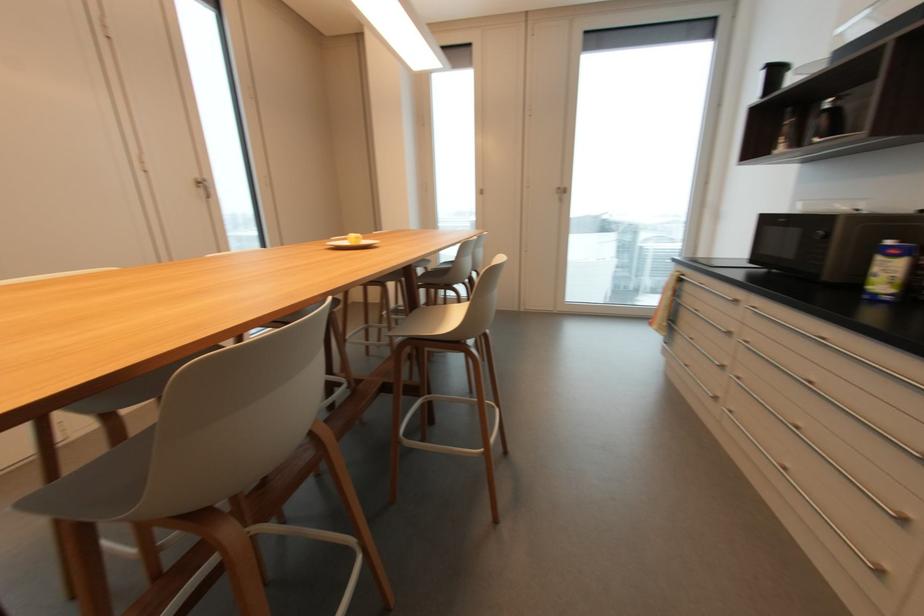
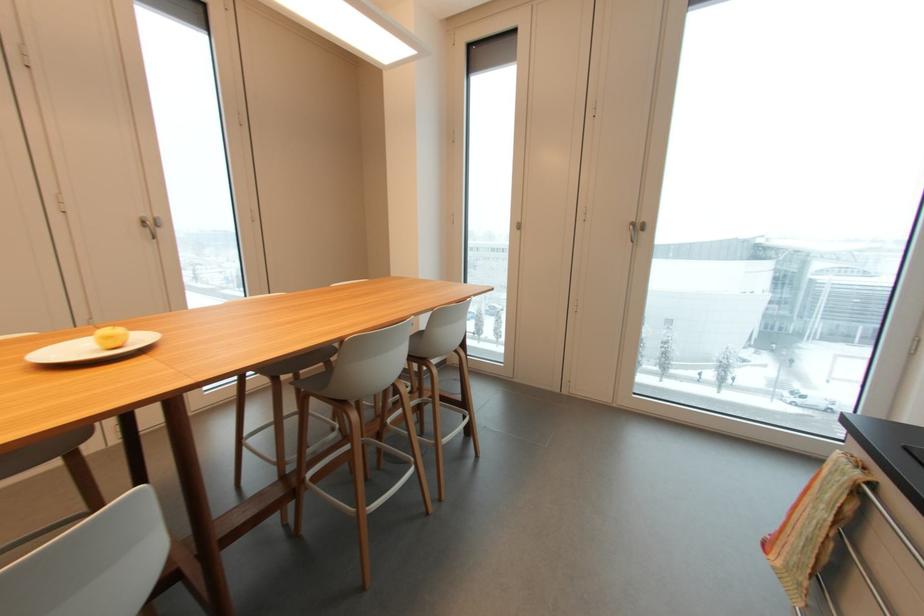
The point at (568, 195) is marked in the first image. Where is the corresponding point in the second image?

(643, 233)